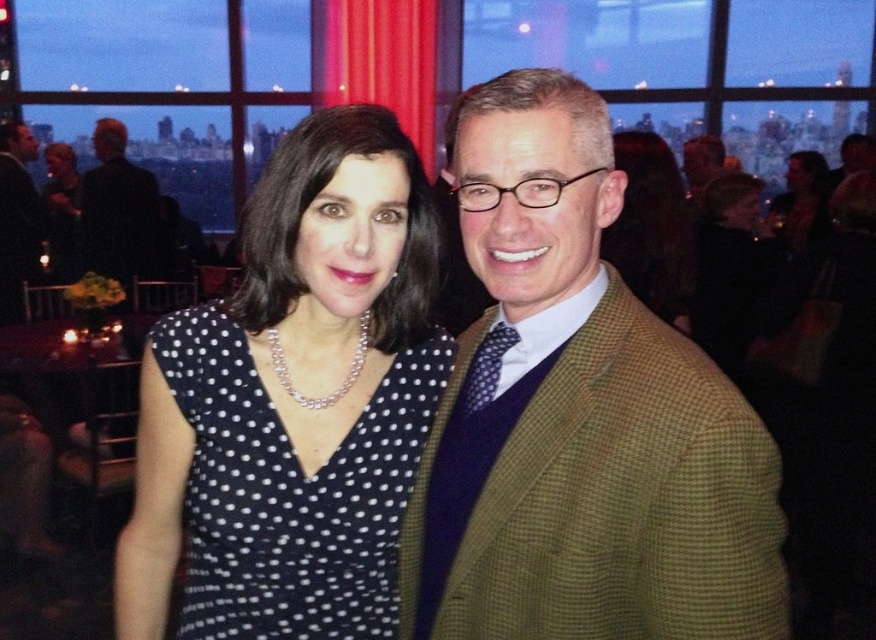
Question: Is green checkered blazer at right positioned at the back of black dotted fabric dress at center?

Choices:
 (A) yes
 (B) no

Answer: (B)

Question: Which object is positioned farthest from the green checkered blazer at right?

Choices:
 (A) black dotted fabric dress at center
 (B) black wool suit at left

Answer: (B)

Question: Can you confirm if black dotted fabric dress at center is positioned to the right of black wool suit at left?

Choices:
 (A) no
 (B) yes

Answer: (B)

Question: Which object is closer to the camera taking this photo?

Choices:
 (A) green checkered blazer at right
 (B) black dotted fabric dress at center

Answer: (A)

Question: Which object is the closest to the black dotted fabric dress at center?

Choices:
 (A) green checkered blazer at right
 (B) black wool suit at left

Answer: (A)

Question: Does green checkered blazer at right have a smaller size compared to black wool suit at left?

Choices:
 (A) no
 (B) yes

Answer: (B)